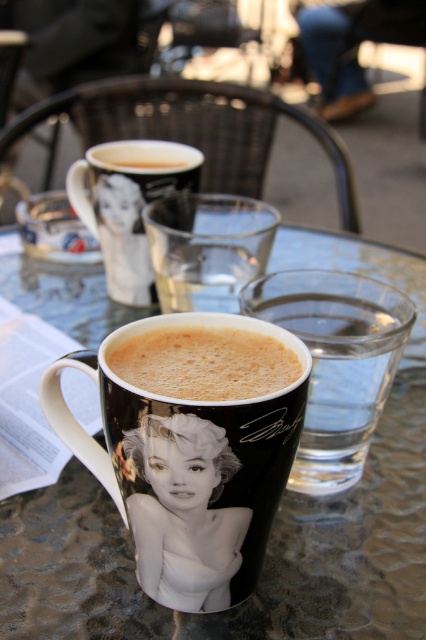
You are a customer at the cafe and want to place your phone on the transparent glass table at center. Can you place it directly over the black glossy mug at center without it falling through?

The transparent glass table at center is positioned over the black glossy mug at center, so placing your phone directly over the mug would be safe as the table provides a solid surface above it.

You are a barista trying to place a new drink order on the table. The table has a coordinate system where the bottom left corner is the origin. The matte black coffee cup at center is already placed at point 0.567, 0.789. Where should you place the new drink to avoid overlapping with the existing cup?

The new drink should be placed away from the coordinates (336, 362) to avoid overlapping with the matte black coffee cup at center.

You are a barista trying to clean the table. You need to move the black glossy mug at center and the matte black coffee cup at center. Which one should you move first to access the one behind?

The black glossy mug at center is in front of the matte black coffee cup at center, so you should move the black glossy mug at center first to access the matte black coffee cup at center.